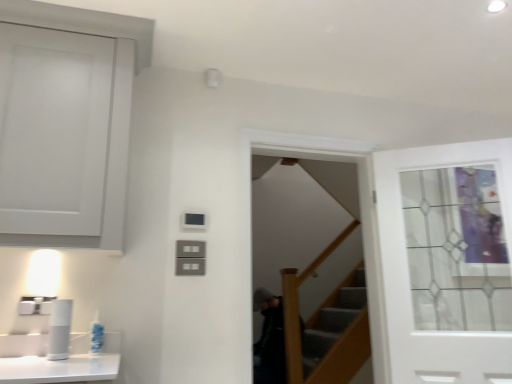
Question: Is clear glass screen door at center at the left side of white plastic toothbrush at lower left?

Choices:
 (A) yes
 (B) no

Answer: (B)

Question: Does clear glass screen door at center come behind white plastic toothbrush at lower left?

Choices:
 (A) yes
 (B) no

Answer: (A)

Question: Does clear glass screen door at center come in front of white plastic toothbrush at lower left?

Choices:
 (A) no
 (B) yes

Answer: (A)

Question: Is clear glass screen door at center oriented away from white plastic toothbrush at lower left?

Choices:
 (A) yes
 (B) no

Answer: (B)

Question: From a real-world perspective, is clear glass screen door at center beneath white plastic toothbrush at lower left?

Choices:
 (A) no
 (B) yes

Answer: (A)

Question: From the image's perspective, is clear glass screen door at center positioned above or below white plastic toothbrush at lower left?

Choices:
 (A) below
 (B) above

Answer: (B)

Question: Considering the positions of clear glass screen door at center and white plastic toothbrush at lower left in the image, is clear glass screen door at center wider or thinner than white plastic toothbrush at lower left?

Choices:
 (A) thin
 (B) wide

Answer: (B)

Question: Is point (326, 188) closer or farther from the camera than point (92, 334)?

Choices:
 (A) farther
 (B) closer

Answer: (A)

Question: Based on their sizes in the image, would you say clear glass screen door at center is bigger or smaller than white plastic toothbrush at lower left?

Choices:
 (A) big
 (B) small

Answer: (A)

Question: Looking at the image, does white glass door at upper right seem bigger or smaller compared to white plastic toothbrush at lower left?

Choices:
 (A) small
 (B) big

Answer: (B)

Question: From the image's perspective, is white glass door at upper right positioned above or below white plastic toothbrush at lower left?

Choices:
 (A) below
 (B) above

Answer: (B)

Question: Looking at their shapes, would you say white glass door at upper right is wider or thinner than white plastic toothbrush at lower left?

Choices:
 (A) wide
 (B) thin

Answer: (A)

Question: Is white glass door at upper right taller or shorter than white plastic toothbrush at lower left?

Choices:
 (A) tall
 (B) short

Answer: (A)

Question: In the image, is white plastic toothbrush at lower left positioned in front of or behind white glass door at upper right?

Choices:
 (A) behind
 (B) front

Answer: (B)

Question: Looking at the image, does white plastic toothbrush at lower left seem bigger or smaller compared to white glass door at upper right?

Choices:
 (A) small
 (B) big

Answer: (A)